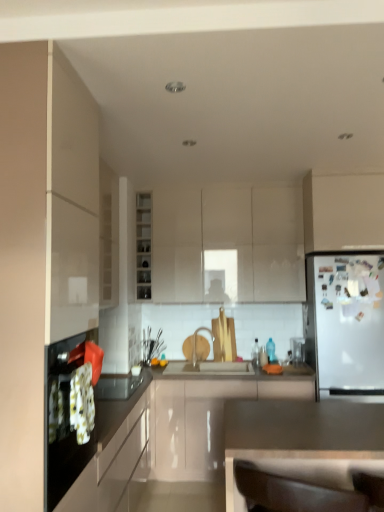
Question: Is white glossy cabinet at upper right, which is the fourth cabinetry in back-to-front order, shorter than glossy white countertop at lower center, arranged as the 2th countertop when viewed from the front?

Choices:
 (A) yes
 (B) no

Answer: (A)

Question: Is glossy white countertop at lower center, arranged as the 2th countertop when viewed from the front, surrounded by white glossy cabinet at upper right, the third cabinetry when ordered from front to back?

Choices:
 (A) no
 (B) yes

Answer: (A)

Question: From the image's perspective, is white glossy cabinet at upper right, which is the fourth cabinetry in back-to-front order, on glossy white countertop at lower center, arranged as the 2th countertop when viewed from the front?

Choices:
 (A) no
 (B) yes

Answer: (B)

Question: Does white glossy cabinet at upper right, which is the fourth cabinetry in back-to-front order, turn towards glossy white countertop at lower center, positioned as the 1th countertop in back-to-front order?

Choices:
 (A) yes
 (B) no

Answer: (B)

Question: Considering the relative sizes of white glossy cabinet at upper right, which is the fourth cabinetry in back-to-front order, and glossy white countertop at lower center, positioned as the 1th countertop in back-to-front order, in the image provided, is white glossy cabinet at upper right, which is the fourth cabinetry in back-to-front order, bigger than glossy white countertop at lower center, positioned as the 1th countertop in back-to-front order,?

Choices:
 (A) no
 (B) yes

Answer: (A)

Question: Is white glossy cabinet at upper right, which is the fourth cabinetry in back-to-front order, with glossy white countertop at lower center, arranged as the 2th countertop when viewed from the front?

Choices:
 (A) no
 (B) yes

Answer: (A)

Question: Does glossy white cabinet at center, which is the 4th cabinetry in front-to-back order, have a lesser height compared to matte white cabinet at left, arranged as the 1th cabinetry when viewed from the front?

Choices:
 (A) yes
 (B) no

Answer: (A)

Question: Is glossy white cabinet at center, which is the 4th cabinetry in front-to-back order, far away from matte white cabinet at left, positioned as the sixth cabinetry in back-to-front order?

Choices:
 (A) no
 (B) yes

Answer: (B)

Question: Is glossy white cabinet at center, positioned as the third cabinetry in back-to-front order, with matte white cabinet at left, positioned as the sixth cabinetry in back-to-front order?

Choices:
 (A) yes
 (B) no

Answer: (B)

Question: Is glossy white cabinet at center, which is the 4th cabinetry in front-to-back order, at the right side of matte white cabinet at left, arranged as the 1th cabinetry when viewed from the front?

Choices:
 (A) yes
 (B) no

Answer: (A)

Question: Is glossy white cabinet at center, positioned as the third cabinetry in back-to-front order, looking in the opposite direction of matte white cabinet at left, positioned as the sixth cabinetry in back-to-front order?

Choices:
 (A) yes
 (B) no

Answer: (B)

Question: Is glossy white cabinet at center, which is the 4th cabinetry in front-to-back order, not inside matte white cabinet at left, positioned as the sixth cabinetry in back-to-front order?

Choices:
 (A) no
 (B) yes

Answer: (B)

Question: Is glossy white countertop at lower center, arranged as the 2th countertop when viewed from the front, a part of matte white cabinet at center, the 5th cabinetry from the front?

Choices:
 (A) no
 (B) yes

Answer: (A)